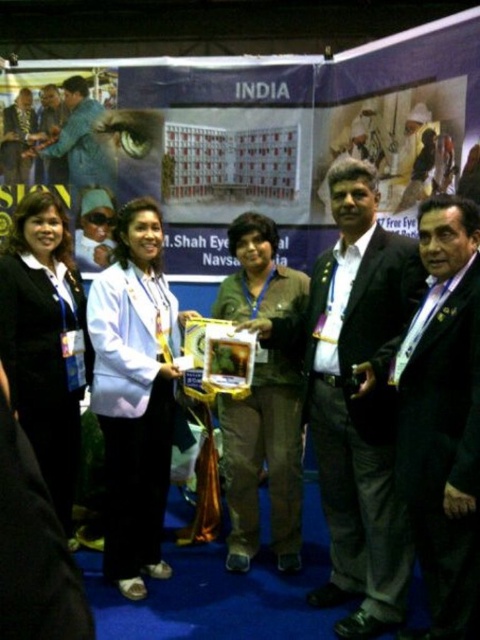
Looking at this image, between black suit at center and matte black suit at center, which one is positioned higher?

Positioned higher is matte black suit at center.

What do you see at coordinates (359, 401) in the screenshot? This screenshot has width=480, height=640. I see `black suit at center` at bounding box center [359, 401].

Is point (308, 358) positioned in front of point (29, 124)?

Yes, it is.

Locate an element on the screen. Image resolution: width=480 pixels, height=640 pixels. black suit at center is located at coordinates (359, 401).

Between white glossy shirt at center and matte black sunglasses at upper left, which one has less height?

matte black sunglasses at upper left is shorter.

Is point (97, 288) in front of point (96, 221)?

That is True.

Is point (131, 486) farther from camera compared to point (90, 244)?

No, (131, 486) is closer to viewer.

Where is `white glossy shirt at center`? The width and height of the screenshot is (480, 640). white glossy shirt at center is located at coordinates (134, 394).

Who is lower down, black fabric at center or matte black suit at center?

Positioned lower is black fabric at center.

Is black fabric at center to the right of matte black suit at center from the viewer's perspective?

Correct, you'll find black fabric at center to the right of matte black suit at center.

Where is `black fabric at center`? Image resolution: width=480 pixels, height=640 pixels. black fabric at center is located at coordinates (45, 340).

You are a GUI agent. You are given a task and a screenshot of the screen. Output one action in this format:
    pyautogui.click(x=<x>, y=<y>)
    Task: Click on the black fabric at center
    The height and width of the screenshot is (640, 480).
    Given the screenshot: What is the action you would take?
    pyautogui.click(x=45, y=340)